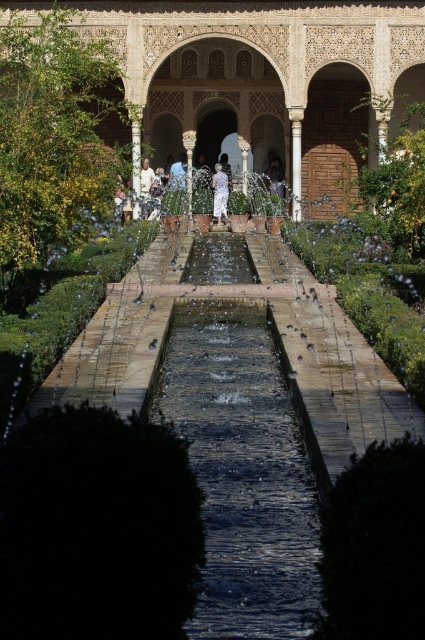
You are a tourist standing in the garden and want to take a photo of the matte white palace at center and the matte stone pillar at center. Which one will appear larger in your photo?

The matte white palace at center will appear larger in your photo because it is much taller than the matte stone pillar at center.

You are standing in the garden of the Alhambra and want to take a photo of the matte white palace at center. If your camera can focus on objects up to 200 feet away, will you need to move closer to capture a clear image?

The matte white palace at center is 240.76 feet away from the viewer, which exceeds the camera maximum focus distance of 200 feet. To capture a clear image, you need to move closer so that the distance is within 200 feet.